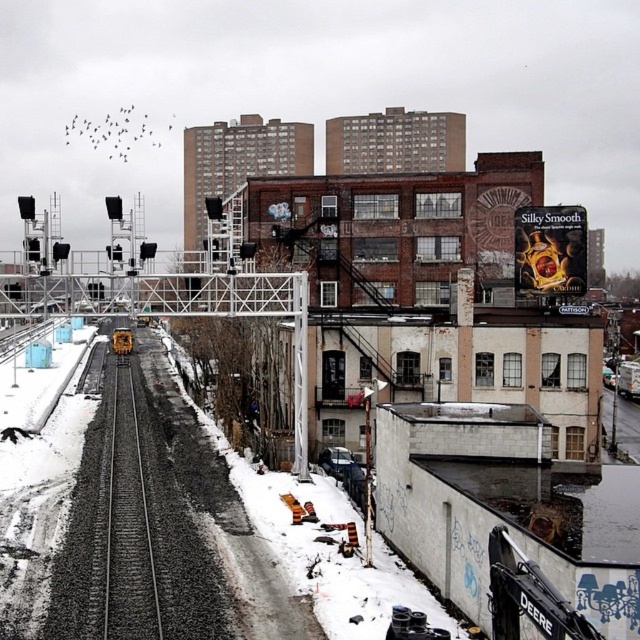
You are a city planner trying to install a new safety barrier between the smooth asphalt train track at center and the yellow metallic train at center. Based on the scene, can you determine if the track is narrow enough to allow the barrier to be placed between them?

The smooth asphalt train track at center is narrower than the yellow metallic train at center, so the barrier can be placed between them as there is sufficient space.

You are a photographer positioned at the edge of the snow covered street. You want to take a photo that includes both the smooth asphalt train track at center and the yellow metallic train at center. Which object will appear larger in your photo?

The smooth asphalt train track at center will appear larger in the photo because it is closer to the viewer than the yellow metallic train at center.